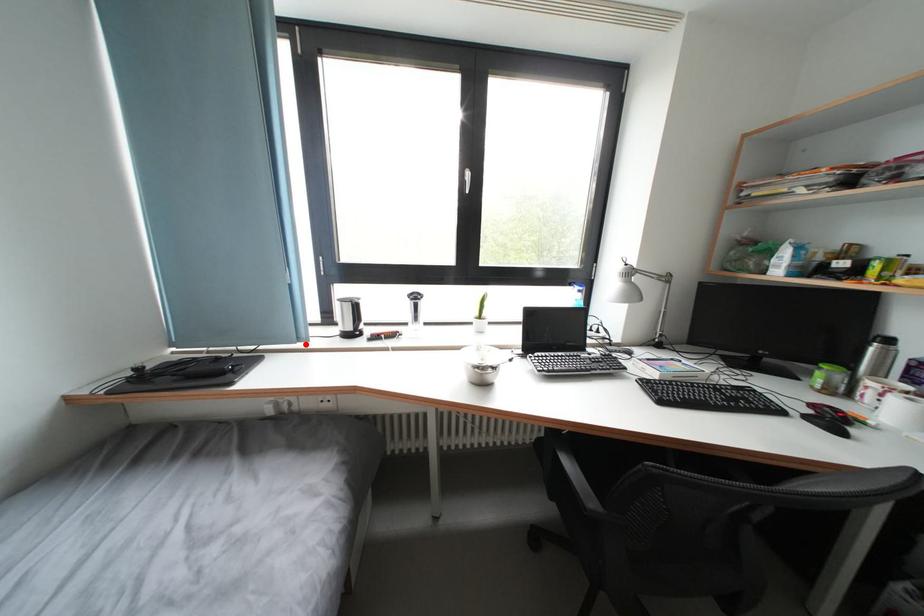
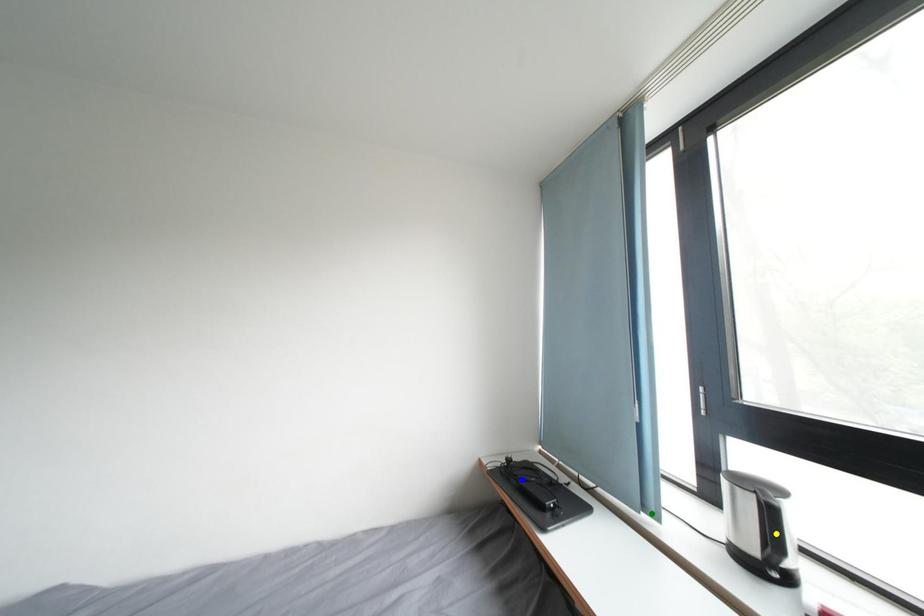
Question: I am providing you with two images of the same scene from different viewpoints. A red point is marked on the first image. You are given multiple points on the second image. In image 2, which mark is for the same physical point as the one in image 1?

Choices:
 (A) green point
 (B) blue point
 (C) yellow point

Answer: (A)